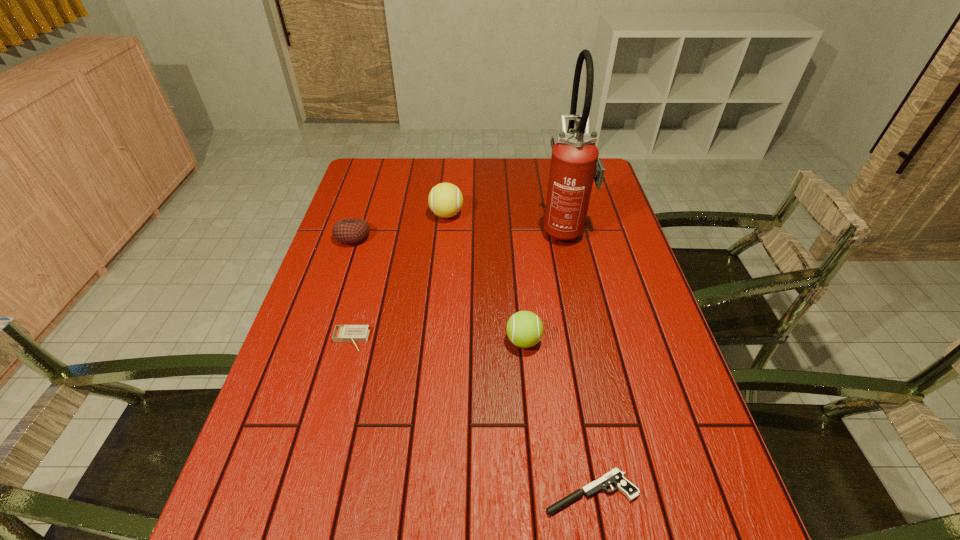
In order to click on free space located 0.200m at the nozzle of the fire extinguisher in this screenshot , I will do `click(479, 228)`.

This screenshot has height=540, width=960. Identify the location of free spot located 0.290m at the nozzle of the fire extinguisher. (451, 228).

Where is `free region located on the left of the farther tennis ball`? This screenshot has height=540, width=960. free region located on the left of the farther tennis ball is located at coordinates (399, 215).

This screenshot has width=960, height=540. Find the location of `free region located on the left of the shorter tennis ball`. free region located on the left of the shorter tennis ball is located at coordinates (437, 341).

Where is `free region located 0.080m on the front of the third shortest object`? This screenshot has height=540, width=960. free region located 0.080m on the front of the third shortest object is located at coordinates tap(344, 266).

The image size is (960, 540). In order to click on vacant region located 0.250m on the striking surface of the fifth tallest object in this screenshot , I will do `click(321, 453)`.

Where is `free space located 0.280m on the front-facing side of the nearest object`? free space located 0.280m on the front-facing side of the nearest object is located at coordinates (396, 492).

This screenshot has width=960, height=540. Identify the location of blank space located on the front-facing side of the nearest object. [438, 492].

At what (x,y) coordinates should I click in order to perform the action: click on free space located on the front-facing side of the nearest object. Please return your answer as a coordinate pair (x, y). Looking at the image, I should click on (370, 492).

Locate an element on the screen. The width and height of the screenshot is (960, 540). beanbag located in the left edge section of the desktop is located at coordinates (350, 231).